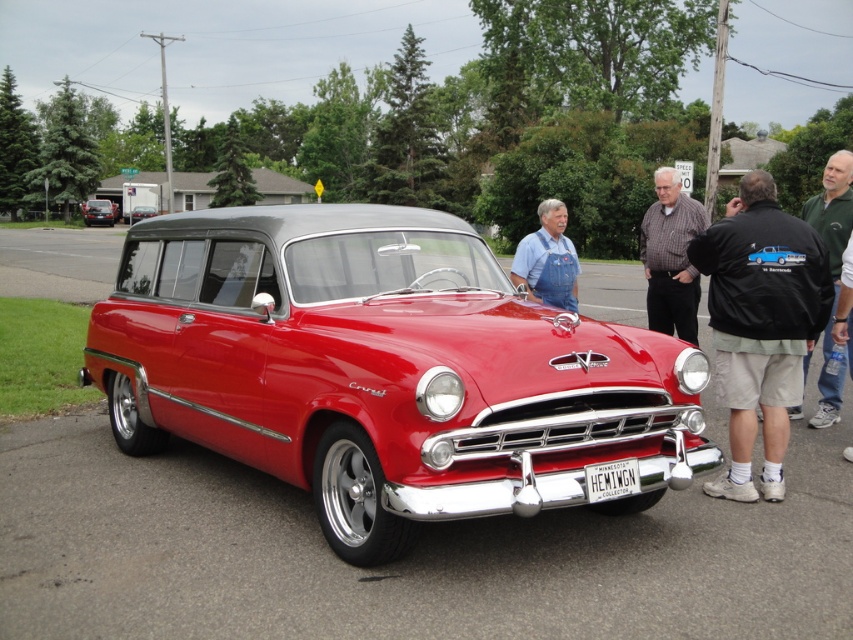
Is shiny red car at center bigger than green cotton shirt at right?

Yes, shiny red car at center is bigger than green cotton shirt at right.

Who is more distant from viewer, (368, 369) or (810, 200)?

Point (810, 200)

Does point (486, 332) lie behind point (828, 404)?

No.

Locate an element on the screen. The height and width of the screenshot is (640, 853). shiny red car at center is located at coordinates (381, 371).

Is shiny red car at center shorter than denim overalls at center?

Yes.

Which of these two, shiny red car at center or denim overalls at center, stands taller?

Standing taller between the two is denim overalls at center.

Identify the location of shiny red car at center. This screenshot has height=640, width=853. (381, 371).

Does black jacket at lower right appear on the left side of glossy red car at center?

No, black jacket at lower right is not to the left of glossy red car at center.

Who is more distant from viewer, (717,339) or (131,218)?

Point (131,218)

This screenshot has height=640, width=853. Identify the location of black jacket at lower right. (759, 324).

You are a GUI agent. You are given a task and a screenshot of the screen. Output one action in this format:
    pyautogui.click(x=<x>, y=<y>)
    Task: Click on the black jacket at lower right
    This screenshot has width=853, height=640.
    Given the screenshot: What is the action you would take?
    pyautogui.click(x=759, y=324)